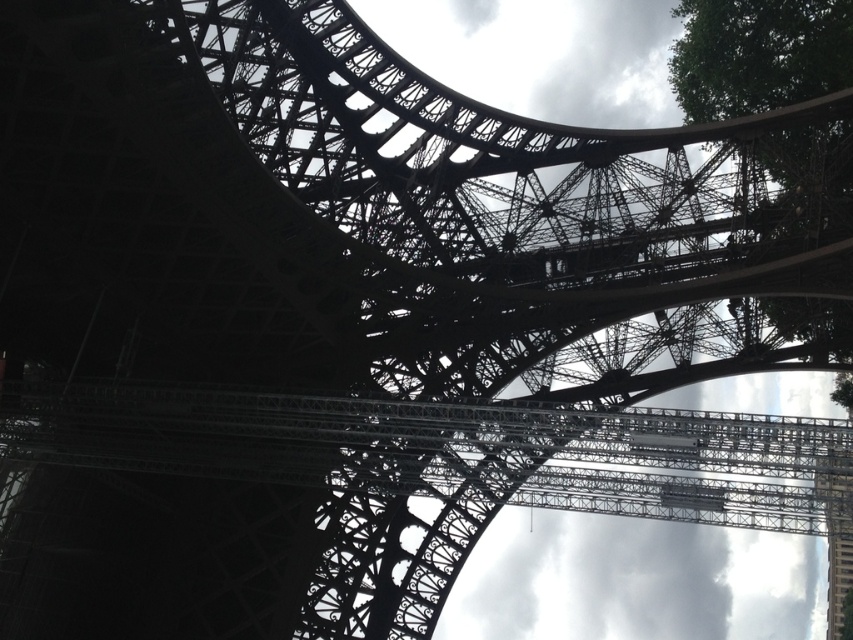
Between point (688, 33) and point (831, 600), which one is positioned in front?

Point (688, 33) is more forward.

Find the location of a particular element. green leafy tree at upper right is located at coordinates (758, 54).